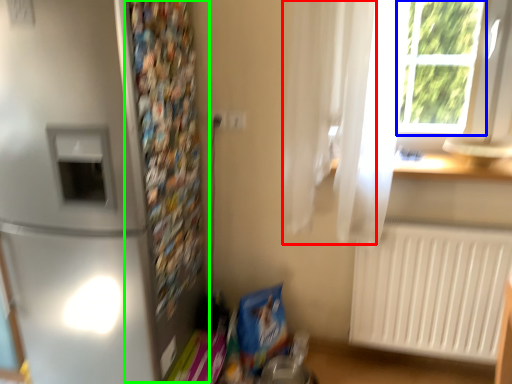
Question: Which is farther away from curtain (highlighted by a red box)? window frame (highlighted by a blue box) or bulletin board (highlighted by a green box)?

Choices:
 (A) window frame
 (B) bulletin board

Answer: (B)